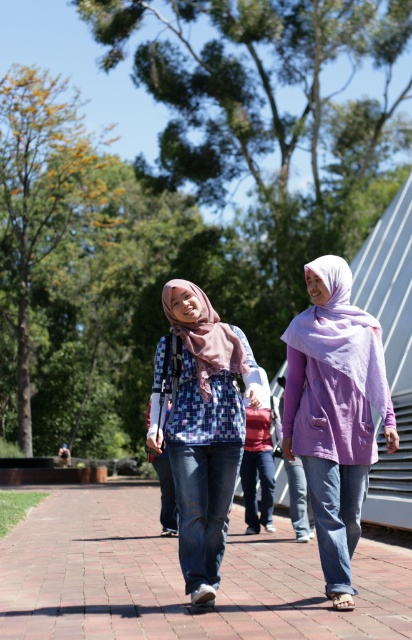
Question: Is brick pavement at center to the left of mauve chiffon hijab at center from the viewer's perspective?

Choices:
 (A) yes
 (B) no

Answer: (A)

Question: Which point appears closest to the camera in this image?

Choices:
 (A) (102, 564)
 (B) (334, 486)
 (C) (184, 552)
 (D) (203, 397)

Answer: (B)

Question: Which of the following is the closest to the observer?

Choices:
 (A) (198, 317)
 (B) (192, 362)
 (C) (391, 449)
 (D) (54, 504)

Answer: (C)

Question: Does brick pavement at center appear over plaid fabric blouse at center?

Choices:
 (A) no
 (B) yes

Answer: (A)

Question: Can you confirm if purple cotton hijab at center is wider than plaid fabric blouse at center?

Choices:
 (A) no
 (B) yes

Answer: (A)

Question: Which of these objects is positioned closest to the brick pavement at center?

Choices:
 (A) plaid fabric blouse at center
 (B) purple cotton hijab at center
 (C) mauve chiffon hijab at center

Answer: (A)